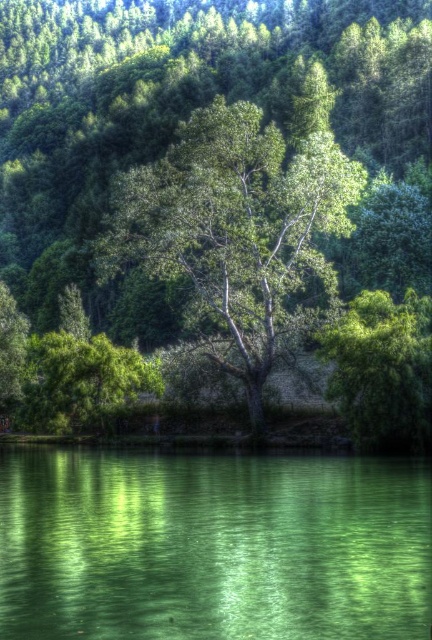
Which is more to the right, green leafy tree at center or green leafy tree at right?

green leafy tree at right is more to the right.

Who is higher up, green leafy tree at center or green leafy tree at right?

green leafy tree at center is above.

Where is `green leafy tree at center`? Image resolution: width=432 pixels, height=640 pixels. green leafy tree at center is located at coordinates (234, 228).

Locate an element on the screen. green leafy tree at center is located at coordinates (234, 228).

Which is above, green reflective water at center or green leafy tree at center?

green leafy tree at center is above.

Is point (257, 483) positioned before point (278, 332)?

Yes, point (257, 483) is closer to viewer.

What do you see at coordinates (212, 547) in the screenshot?
I see `green reflective water at center` at bounding box center [212, 547].

At what (x,y) coordinates should I click in order to perform the action: click on green reflective water at center. Please return your answer as a coordinate pair (x, y). Image resolution: width=432 pixels, height=640 pixels. Looking at the image, I should click on (212, 547).

Can you confirm if green reflective water at center is bigger than green leafy tree at right?

Yes.

Is green reflective water at center positioned at the back of green leafy tree at right?

No, green reflective water at center is closer to the viewer.

You are a GUI agent. You are given a task and a screenshot of the screen. Output one action in this format:
    pyautogui.click(x=<x>, y=<y>)
    Task: Click on the green reflective water at center
    The height and width of the screenshot is (640, 432).
    Given the screenshot: What is the action you would take?
    pyautogui.click(x=212, y=547)